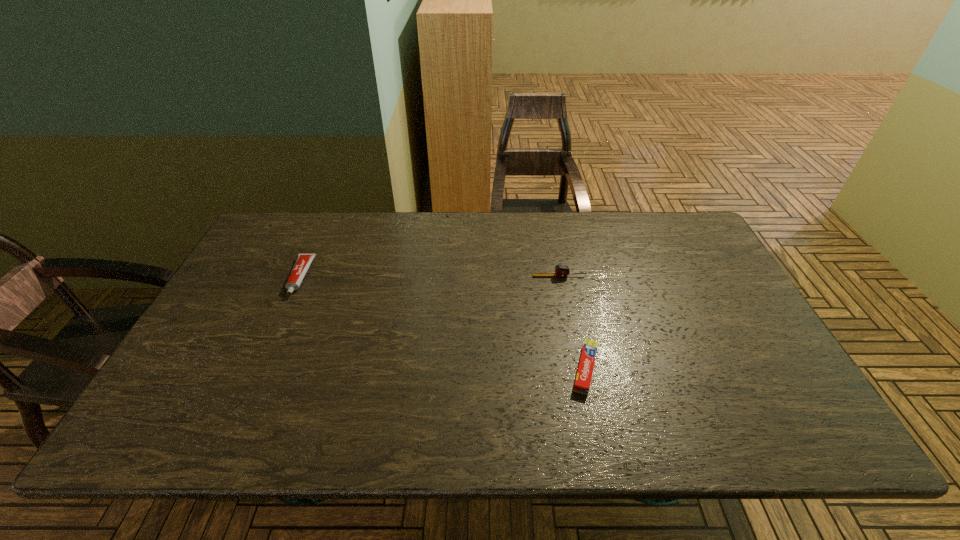
The height and width of the screenshot is (540, 960). Identify the location of free space that is in between the tape measure and the left toothpaste. (430, 276).

You are a GUI agent. You are given a task and a screenshot of the screen. Output one action in this format:
    pyautogui.click(x=<x>, y=<y>)
    Task: Click on the free space between the left toothpaste and the tape measure
    Image resolution: width=960 pixels, height=540 pixels.
    Given the screenshot: What is the action you would take?
    pyautogui.click(x=430, y=276)

Image resolution: width=960 pixels, height=540 pixels. I want to click on free spot between the tape measure and the right toothpaste, so click(x=572, y=323).

Where is `unoccupied position between the taller toothpaste and the tape measure`? unoccupied position between the taller toothpaste and the tape measure is located at coordinates (430, 276).

Where is `vacant point located between the nearer toothpaste and the taller toothpaste`? This screenshot has width=960, height=540. vacant point located between the nearer toothpaste and the taller toothpaste is located at coordinates (443, 323).

Identify which object is located as the nearest to the tape measure. Please provide its 2D coordinates. Your answer should be formatted as a tuple, i.e. [(x, y)], where the tuple contains the x and y coordinates of a point satisfying the conditions above.

[(583, 379)]

You are a GUI agent. You are given a task and a screenshot of the screen. Output one action in this format:
    pyautogui.click(x=<x>, y=<y>)
    Task: Click on the object that is the closest to the tape measure
    
    Given the screenshot: What is the action you would take?
    pyautogui.click(x=583, y=379)

Where is `vacant space that satisfies the following two spatial constraints: 1. at the nozzle of the nearer toothpaste; 2. on the right side of the farther toothpaste`? Image resolution: width=960 pixels, height=540 pixels. vacant space that satisfies the following two spatial constraints: 1. at the nozzle of the nearer toothpaste; 2. on the right side of the farther toothpaste is located at coordinates coord(258,369).

The image size is (960, 540). What are the coordinates of `vacant space that satisfies the following two spatial constraints: 1. at the nozzle of the farther toothpaste; 2. on the right side of the right toothpaste` in the screenshot? It's located at (258, 369).

Find the location of a particular element. This screenshot has height=540, width=960. vacant area in the image that satisfies the following two spatial constraints: 1. at the nozzle of the leftmost object; 2. on the left side of the shorter toothpaste is located at coordinates (258, 369).